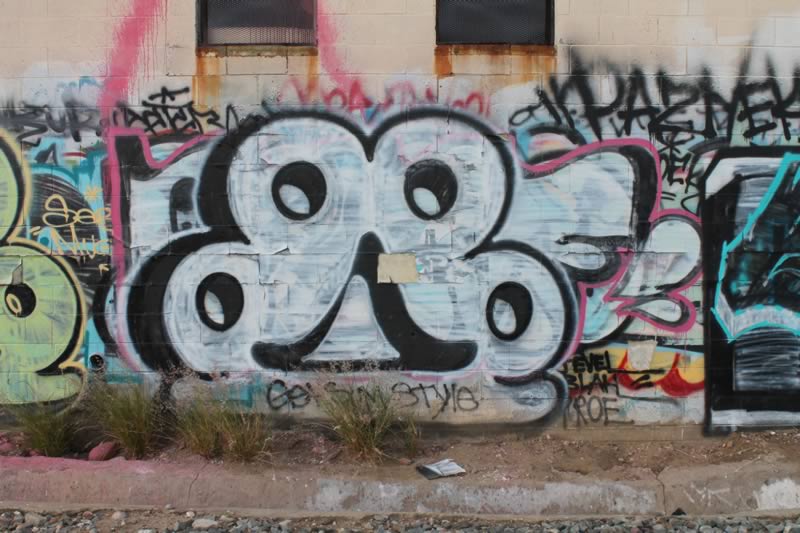
Where is `wall`? Image resolution: width=800 pixels, height=533 pixels. wall is located at coordinates (392, 28).